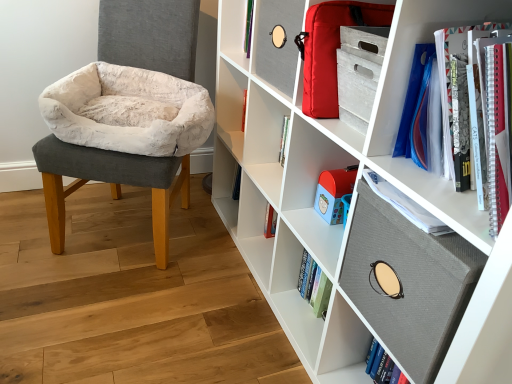
Question: Considering the relative sizes of white matte bookshelf at center, the 1th shelf when ordered from top to bottom, and textured gray board at upper right, which is counted as the first cabinet, starting from the bottom, in the image provided, is white matte bookshelf at center, the 1th shelf when ordered from top to bottom, wider than textured gray board at upper right, which is counted as the first cabinet, starting from the bottom,?

Choices:
 (A) no
 (B) yes

Answer: (A)

Question: Can you confirm if white matte bookshelf at center, the 1th shelf when ordered from top to bottom, is smaller than textured gray board at upper right, which is counted as the first cabinet, starting from the bottom?

Choices:
 (A) no
 (B) yes

Answer: (B)

Question: Are white matte bookshelf at center, the 1th shelf when ordered from top to bottom, and textured gray board at upper right, which ranks as the 2th cabinet in top-to-bottom order, far apart?

Choices:
 (A) no
 (B) yes

Answer: (A)

Question: Is white matte bookshelf at center, which is counted as the 3th shelf, starting from the bottom, to the right of textured gray board at upper right, which ranks as the 2th cabinet in top-to-bottom order, from the viewer's perspective?

Choices:
 (A) no
 (B) yes

Answer: (A)

Question: Is white matte bookshelf at center, the 1th shelf when ordered from top to bottom, closer to the viewer compared to textured gray board at upper right, which is counted as the first cabinet, starting from the bottom?

Choices:
 (A) no
 (B) yes

Answer: (A)

Question: Would you say textured gray board at upper right, which is counted as the first cabinet, starting from the bottom, is part of white matte bookshelf at center, which is counted as the 3th shelf, starting from the bottom,'s contents?

Choices:
 (A) no
 (B) yes

Answer: (A)

Question: Is white plush cushion at left to the right of matte red bag at upper right, which ranks as the second cabinet in bottom-to-top order, from the viewer's perspective?

Choices:
 (A) yes
 (B) no

Answer: (B)

Question: From a real-world perspective, is white plush cushion at left physically below matte red bag at upper right, the first cabinet positioned from the top?

Choices:
 (A) yes
 (B) no

Answer: (A)

Question: Does white plush cushion at left have a greater width compared to matte red bag at upper right, which ranks as the second cabinet in bottom-to-top order?

Choices:
 (A) no
 (B) yes

Answer: (B)

Question: From the image's perspective, is white plush cushion at left above matte red bag at upper right, the first cabinet positioned from the top?

Choices:
 (A) yes
 (B) no

Answer: (B)

Question: Considering the relative sizes of white plush cushion at left and matte red bag at upper right, the first cabinet positioned from the top, in the image provided, is white plush cushion at left shorter than matte red bag at upper right, the first cabinet positioned from the top,?

Choices:
 (A) yes
 (B) no

Answer: (B)

Question: From a real-world perspective, is white plush cushion at left located higher than matte red bag at upper right, which ranks as the second cabinet in bottom-to-top order?

Choices:
 (A) yes
 (B) no

Answer: (B)

Question: Does textured gray board at upper right, which is counted as the first cabinet, starting from the bottom, lie behind white matte bookshelf at center, which is counted as the 3th shelf, starting from the bottom?

Choices:
 (A) yes
 (B) no

Answer: (B)